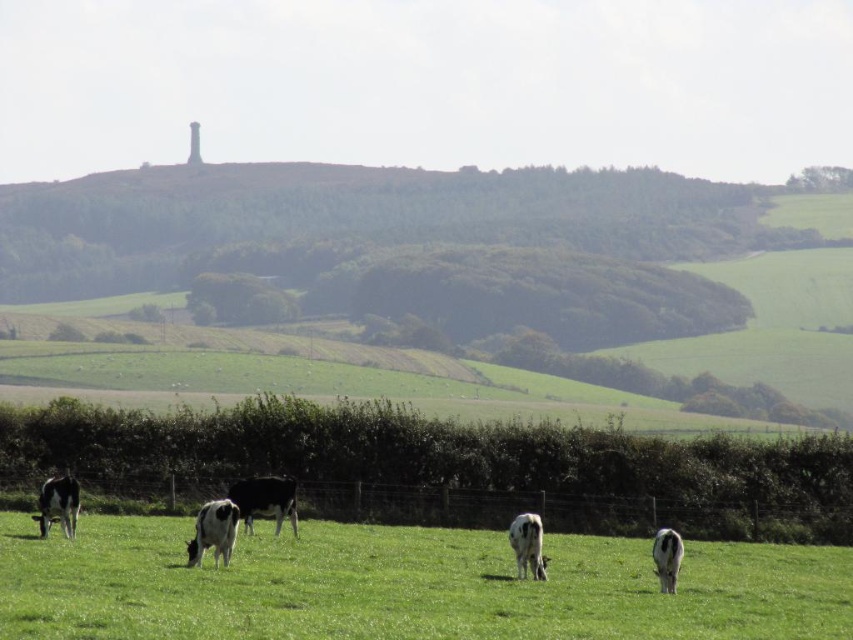
Question: Considering the relative positions of metal wire fence at lower center and white glossy cow at center in the image provided, where is metal wire fence at lower center located with respect to white glossy cow at center?

Choices:
 (A) above
 (B) below

Answer: (B)

Question: Which point is farther from the camera taking this photo?

Choices:
 (A) (677, 557)
 (B) (200, 518)
 (C) (531, 552)

Answer: (C)

Question: Is white glossy cow at center positioned behind white glossy cow at lower right?

Choices:
 (A) yes
 (B) no

Answer: (A)

Question: Estimate the real-world distances between objects in this image. Which object is closer to the black glossy cow at center?

Choices:
 (A) metal wire fence at lower center
 (B) white glossy cow at center
 (C) black glossy cow at lower left

Answer: (A)

Question: Which of the following is the closest to the observer?

Choices:
 (A) (679, 538)
 (B) (16, 502)
 (C) (532, 593)
 (D) (292, 497)

Answer: (C)

Question: Can you confirm if metal wire fence at lower center is positioned above black glossy cow at lower left?

Choices:
 (A) no
 (B) yes

Answer: (A)